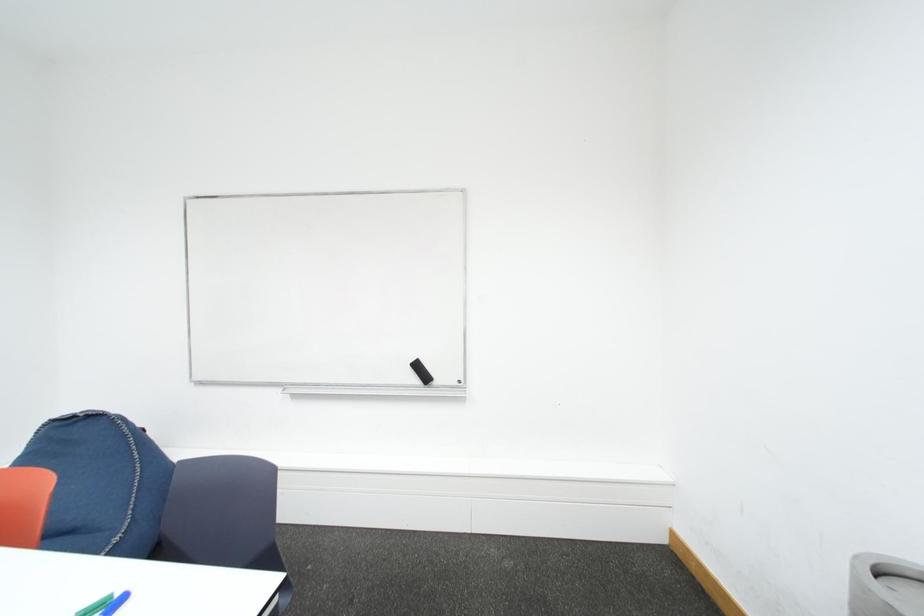
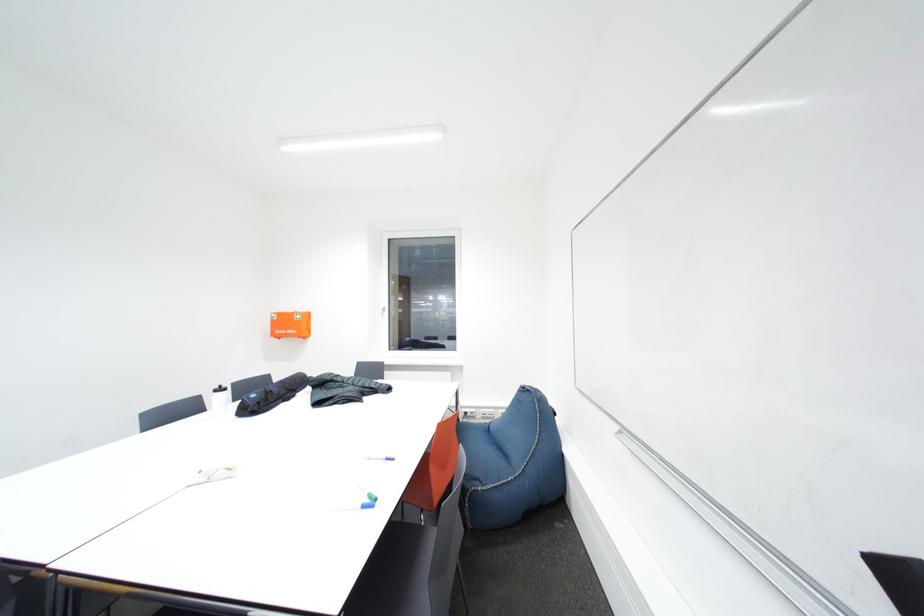
Question: Based on the continuous images, in which direction is the camera rotating? Reply with the corresponding letter.

Choices:
 (A) Left
 (B) Right
 (C) Up
 (D) Down

Answer: (A)